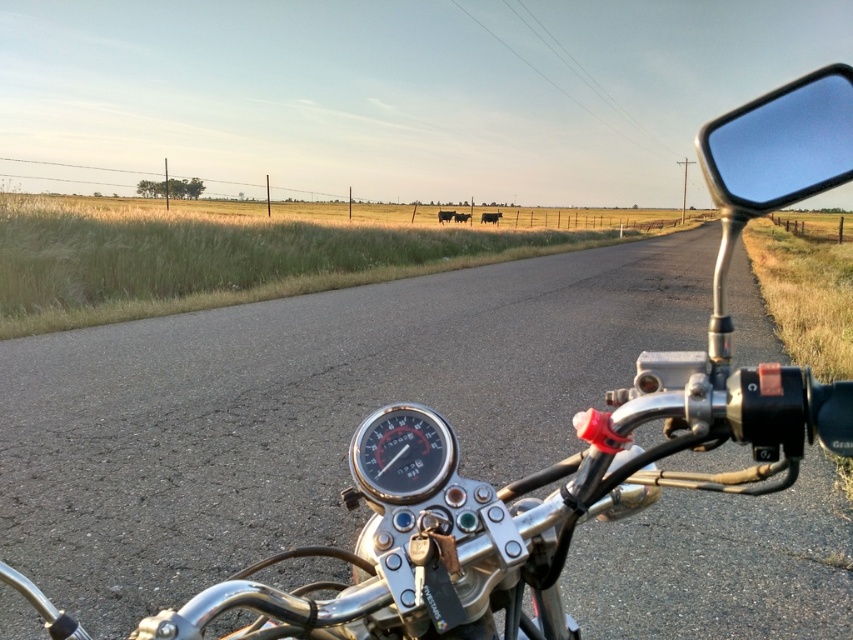
Question: Which point appears farthest from the camera in this image?

Choices:
 (A) (456, 460)
 (B) (810, 125)

Answer: (A)

Question: Can you confirm if green grass at left is positioned above clear glass mirror at right?

Choices:
 (A) yes
 (B) no

Answer: (A)

Question: Based on their relative distances, which object is nearer to the green grass at left?

Choices:
 (A) black plastic speedometer at center
 (B) clear glass mirror at right

Answer: (A)

Question: Which object appears farthest from the camera in this image?

Choices:
 (A) clear glass mirror at right
 (B) green grass at left
 (C) black plastic speedometer at center

Answer: (B)

Question: Can you confirm if clear glass mirror at right is positioned below black plastic speedometer at center?

Choices:
 (A) no
 (B) yes

Answer: (A)

Question: Is green grass at left smaller than black plastic speedometer at center?

Choices:
 (A) yes
 (B) no

Answer: (B)